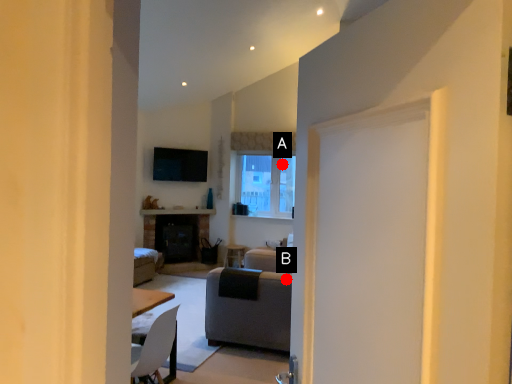
Question: Two points are circled on the image, labeled by A and B beside each circle. Which of the following is the farthest from the observer?

Choices:
 (A) A is further
 (B) B is further

Answer: (A)